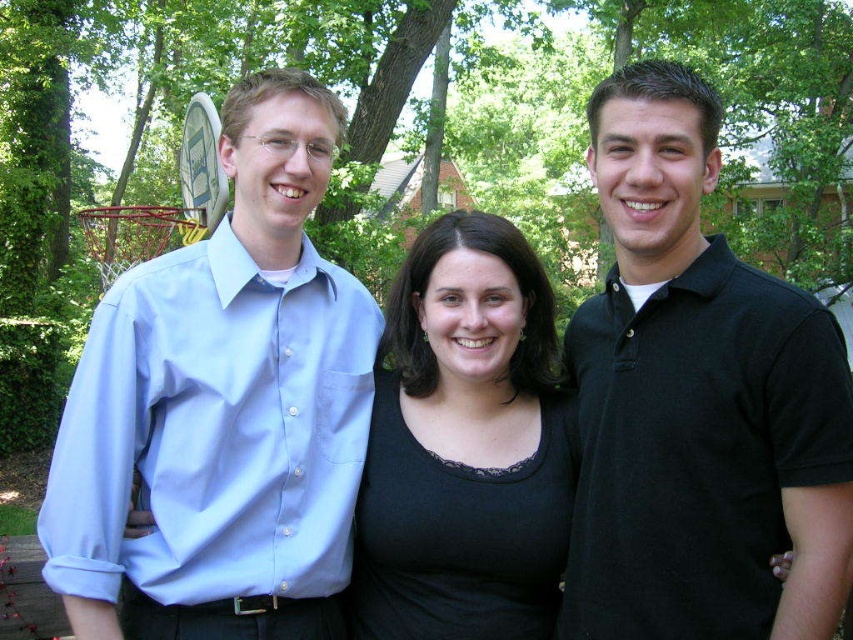
Looking at this image, you are planning to take a group photo of the light blue cotton shirt at left and the black polo shirt at right. If your camera has a maximum focus range of 5 feet, will both subjects be in focus if they stand at their current positions?

The distance between the light blue cotton shirt at left and the black polo shirt at right is 4.78 feet, which is within the camera maximum focus range of 5 feet. Therefore, both subjects will be in focus.

You are standing in the backyard and want to place a small potted plant between the two points, point (699, 484) and point (473, 240). Which point should the plant be closer to in order to be nearer to the basketball hoop located behind the left person?

The basketball hoop is behind the person on the left. Since point (699, 484) is closer to the viewer than point (473, 240), placing the plant closer to point (699, 484) would position it nearer to the basketball hoop behind the left person.